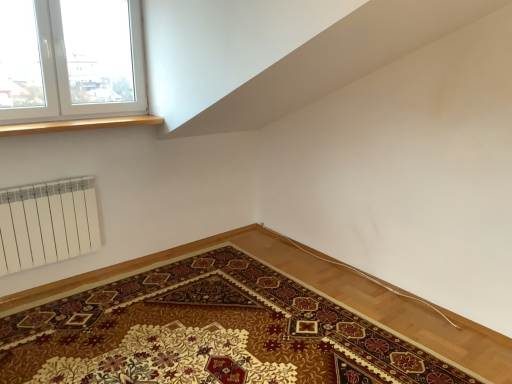
Measure the distance between carpeted mat at lower left and camera.

The distance of carpeted mat at lower left from camera is 7.49 feet.

Locate an element on the screen. This screenshot has height=384, width=512. wooden at upper left is located at coordinates (78, 125).

What's the angular difference between wooden at upper left and white plastic window at upper left's facing directions?

The angular difference between wooden at upper left and white plastic window at upper left is 0.000857 degrees.

Which object is closer to the camera, wooden at upper left or white plastic window at upper left?

white plastic window at upper left is closer to the camera.

Would you say wooden at upper left is inside or outside white plastic window at upper left?

wooden at upper left exists outside the volume of white plastic window at upper left.

Find the location of a particular element. Image resolution: width=512 pixels, height=384 pixels. window in front of the wooden at upper left is located at coordinates (71, 60).

Considering the positions of objects white plastic window at upper left and wooden at upper left in the image provided, who is in front, white plastic window at upper left or wooden at upper left?

white plastic window at upper left.

Is wooden at upper left a part of white plastic window at upper left?

That's incorrect, wooden at upper left is not inside white plastic window at upper left.

Find the location of a particular element. The image size is (512, 384). window that is on the left side of wooden at upper left is located at coordinates (71, 60).

Which object is positioned more to the left, carpeted mat at lower left or white plastic window at upper left?

From the viewer's perspective, white plastic window at upper left appears more on the left side.

Is point (179, 356) closer to viewer compared to point (91, 91)?

That is True.

Looking at this image, is carpeted mat at lower left situated inside white plastic window at upper left or outside?

carpeted mat at lower left is not inside white plastic window at upper left, it's outside.

Find the location of a particular element. The image size is (512, 384). window sill above the carpeted mat at lower left (from the image's perspective) is located at coordinates (78, 125).

From the picture: How far apart are carpeted mat at lower left and wooden at upper left?

The distance of carpeted mat at lower left from wooden at upper left is 5.14 feet.

Is carpeted mat at lower left facing away from wooden at upper left?

No, carpeted mat at lower left is not facing away from wooden at upper left.

Would you say carpeted mat at lower left is to the left or to the right of wooden at upper left in the picture?

Based on their positions, carpeted mat at lower left is located to the right of wooden at upper left.

Is wooden at upper left not near carpeted mat at lower left?

Yes, wooden at upper left and carpeted mat at lower left are quite far apart.

Is wooden at upper left inside the boundaries of carpeted mat at lower left, or outside?

wooden at upper left cannot be found inside carpeted mat at lower left.

Can you confirm if wooden at upper left is smaller than carpeted mat at lower left?

Yes, wooden at upper left is smaller than carpeted mat at lower left.

Between white plastic window at upper left and carpeted mat at lower left, which one has larger width?

With larger width is carpeted mat at lower left.

Is carpeted mat at lower left completely or partially inside white plastic window at upper left?

No, white plastic window at upper left does not contain carpeted mat at lower left.

Considering the sizes of objects white plastic window at upper left and carpeted mat at lower left in the image provided, who is smaller, white plastic window at upper left or carpeted mat at lower left?

With smaller size is white plastic window at upper left.

Between white plastic window at upper left and carpeted mat at lower left, which one is positioned in front?

carpeted mat at lower left.

At what (x,y) coordinates should I click in order to perform the action: click on window sill behind the white plastic window at upper left. Please return your answer as a coordinate pair (x, y). The width and height of the screenshot is (512, 384). Looking at the image, I should click on (78, 125).

At what (x,y) coordinates should I click in order to perform the action: click on window in front of the wooden at upper left. Please return your answer as a coordinate pair (x, y). This screenshot has height=384, width=512. Looking at the image, I should click on (71, 60).

When comparing their distances from white plastic window at upper left, does carpeted mat at lower left or wooden at upper left seem closer?

Based on the image, wooden at upper left appears to be nearer to white plastic window at upper left.

Looking at the image, which one is located closer to wooden at upper left, carpeted mat at lower left or white plastic window at upper left?

white plastic window at upper left lies closer to wooden at upper left than the other object.

Estimate the real-world distances between objects in this image. Which object is closer to carpeted mat at lower left, wooden at upper left or white plastic window at upper left?

wooden at upper left is closer to carpeted mat at lower left.

Looking at the image, which one is located further to white plastic window at upper left, wooden at upper left or carpeted mat at lower left?

carpeted mat at lower left is further to white plastic window at upper left.

Consider the image. Considering their positions, is white plastic window at upper left positioned closer to carpeted mat at lower left than wooden at upper left?

wooden at upper left lies closer to carpeted mat at lower left than the other object.

From the image, which object appears to be nearer to wooden at upper left, white plastic window at upper left or carpeted mat at lower left?

white plastic window at upper left is positioned closer to the anchor wooden at upper left.

You are a GUI agent. You are given a task and a screenshot of the screen. Output one action in this format:
    pyautogui.click(x=<x>, y=<y>)
    Task: Click on the window sill that lies between white plastic window at upper left and carpeted mat at lower left from top to bottom
    The image size is (512, 384).
    Given the screenshot: What is the action you would take?
    pyautogui.click(x=78, y=125)